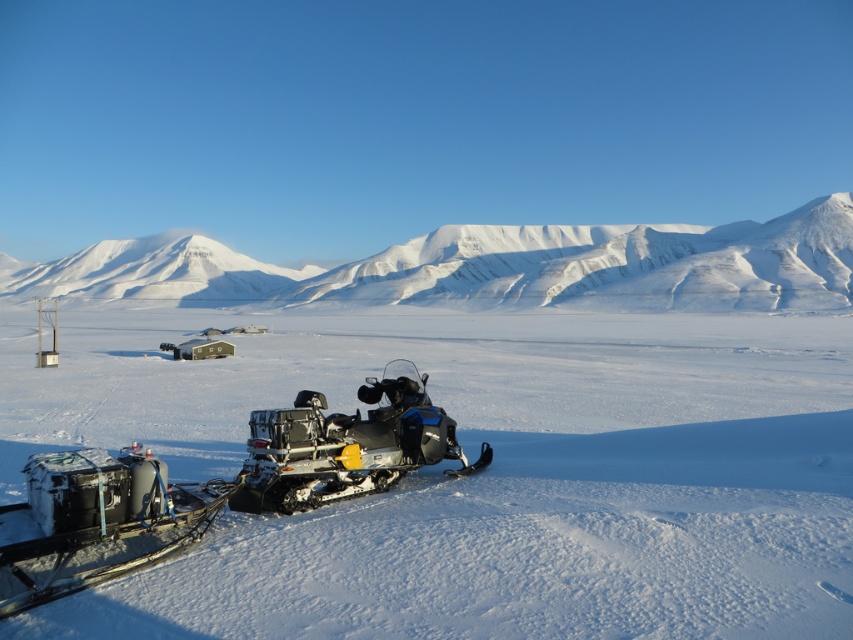
Is silver metallic snowmobile at center wider than metallic blue snowmobile at center?

No.

The height and width of the screenshot is (640, 853). What are the coordinates of `silver metallic snowmobile at center` in the screenshot? It's located at (213, 486).

Between point (485, 445) and point (482, 464), which one is positioned in front?

Point (482, 464)

This screenshot has height=640, width=853. I want to click on silver metallic snowmobile at center, so click(213, 486).

Does white powdery snow at center have a smaller size compared to white snow-covered mountain at upper center?

Correct, white powdery snow at center occupies less space than white snow-covered mountain at upper center.

Is point (47, 621) less distant than point (666, 234)?

Yes, it is in front of point (666, 234).

Is point (354, 371) farther from viewer compared to point (521, 250)?

No.

The image size is (853, 640). I want to click on white powdery snow at center, so click(x=477, y=476).

Does white powdery snow at center come in front of silver metallic snowmobile at center?

Yes, it is.

Can you confirm if white powdery snow at center is smaller than silver metallic snowmobile at center?

Actually, white powdery snow at center might be larger than silver metallic snowmobile at center.

Is point (520, 609) less distant than point (62, 497)?

Yes, point (520, 609) is in front of point (62, 497).

The image size is (853, 640). Identify the location of white powdery snow at center. (477, 476).